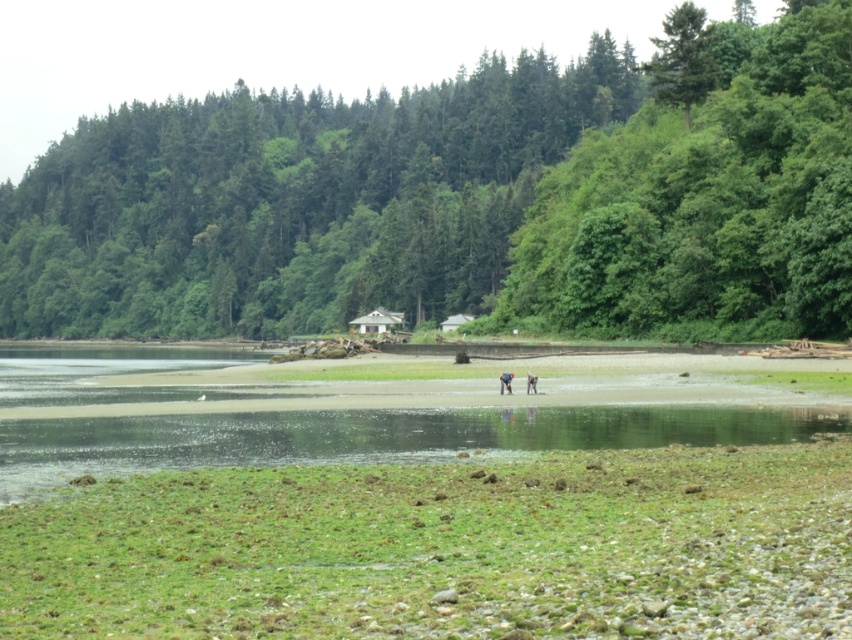
You are standing on the beach and see the dark gray fabric person at center and the light brown leather jacket at center. Which one is nearer to you?

The dark gray fabric person at center is closer to the viewer than the light brown leather jacket at center.

You are standing on the beach and want to take a photo of both the green leafy tree at center and the dark gray fabric person at center. Which object should you zoom in on to ensure both fit in the frame?

You should zoom in on the dark gray fabric person at center because the green leafy tree at center might be wider than the dark gray fabric person at center, so zooming in on the wider object ensures both fit in the frame.

You are standing at the point marked as point (505, 381) in the image. What object is located exactly at your current position?

The dark gray fabric person at center is located exactly at point (505, 381).